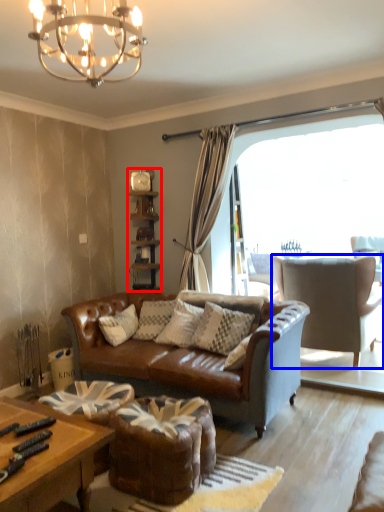
Question: Which point is closer to the camera, shelf (highlighted by a red box) or chair (highlighted by a blue box)?

Choices:
 (A) shelf
 (B) chair

Answer: (B)